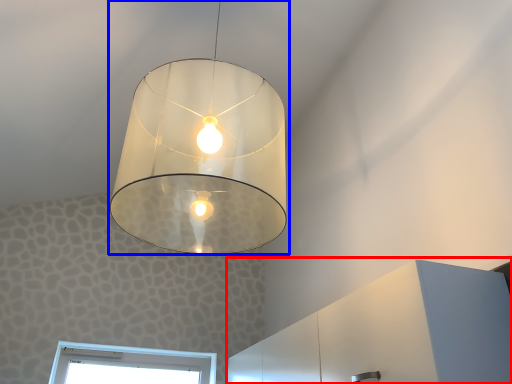
Question: Which object appears closest to the camera in this image, dresser (highlighted by a red box) or lamp (highlighted by a blue box)?

Choices:
 (A) dresser
 (B) lamp

Answer: (B)